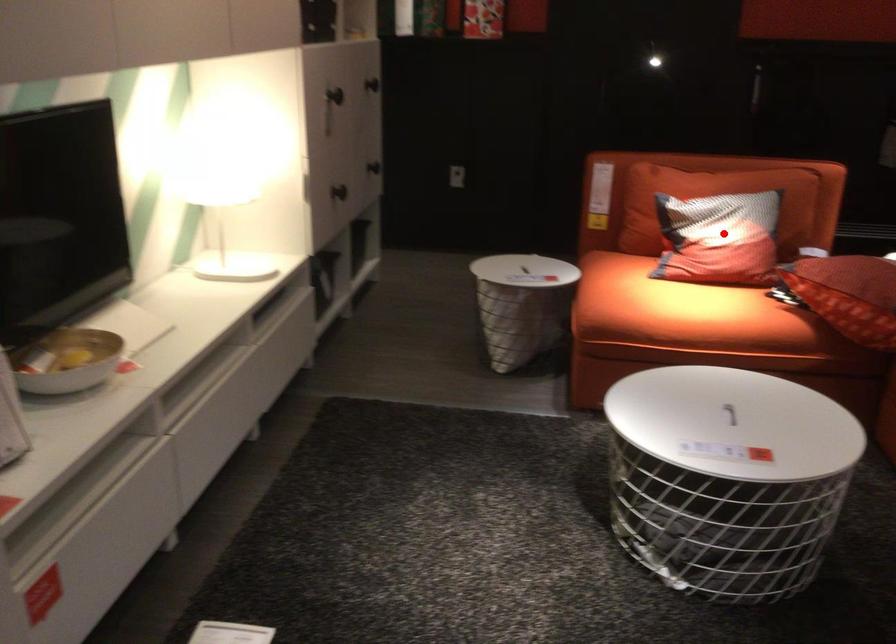
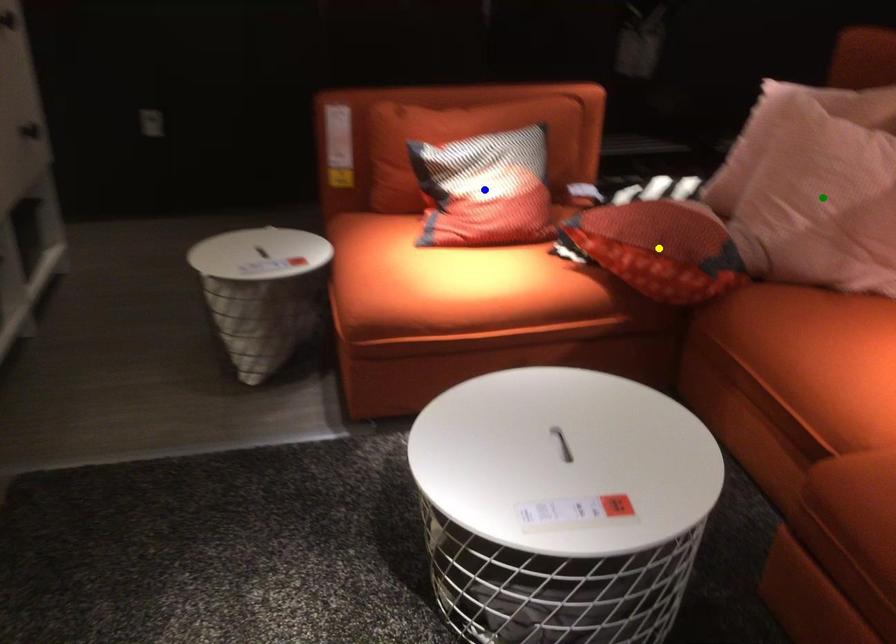
Question: I am providing you with two images of the same scene from different viewpoints. A red point is marked on the first image. You are given multiple points on the second image. Which spot in image 2 lines up with the point in image 1?

Choices:
 (A) blue point
 (B) yellow point
 (C) green point

Answer: (A)